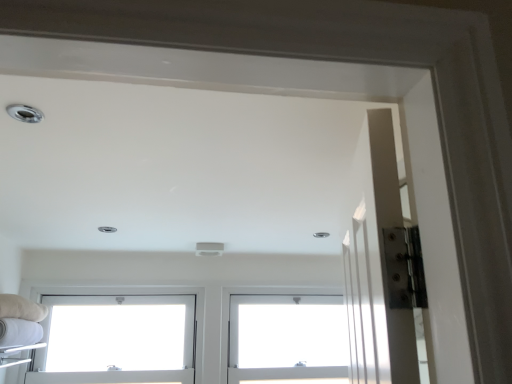
Question: Is white plastic window at lower left, the 1th window from the left, oriented away from white plastic window at center, the first window viewed from the right?

Choices:
 (A) yes
 (B) no

Answer: (B)

Question: Is white plastic window at lower left, the 1th window from the left, taller than white plastic window at center, the first window viewed from the right?

Choices:
 (A) no
 (B) yes

Answer: (A)

Question: Is white plastic window at lower left, the 1th window from the left, in front of white plastic window at center, which appears as the second window when viewed from the left?

Choices:
 (A) no
 (B) yes

Answer: (B)

Question: Is white plastic window at lower left, which appears as the second window when viewed from the right, bigger than white plastic window at center, the first window viewed from the right?

Choices:
 (A) no
 (B) yes

Answer: (B)

Question: Is white plastic window at lower left, the 1th window from the left, outside of white plastic window at center, which appears as the second window when viewed from the left?

Choices:
 (A) no
 (B) yes

Answer: (B)

Question: Does white plastic window at lower left, the 1th window from the left, turn towards white plastic window at center, the first window viewed from the right?

Choices:
 (A) yes
 (B) no

Answer: (B)

Question: Is white plastic window at center, the first window viewed from the right, taller than white plastic window at lower left, which appears as the second window when viewed from the right?

Choices:
 (A) yes
 (B) no

Answer: (A)

Question: Are white plastic window at center, which appears as the second window when viewed from the left, and white plastic window at lower left, the 1th window from the left, beside each other?

Choices:
 (A) no
 (B) yes

Answer: (A)

Question: Is white plastic window at center, the first window viewed from the right, positioned beyond the bounds of white plastic window at lower left, the 1th window from the left?

Choices:
 (A) no
 (B) yes

Answer: (B)

Question: From a real-world perspective, is white plastic window at center, the first window viewed from the right, below white plastic window at lower left, which appears as the second window when viewed from the right?

Choices:
 (A) no
 (B) yes

Answer: (B)

Question: Is white plastic window at center, which appears as the second window when viewed from the left, further to camera compared to white plastic window at lower left, which appears as the second window when viewed from the right?

Choices:
 (A) no
 (B) yes

Answer: (B)

Question: Could you tell me if white plastic window at center, which appears as the second window when viewed from the left, is turned towards white plastic window at lower left, the 1th window from the left?

Choices:
 (A) no
 (B) yes

Answer: (A)

Question: Considering the positions of point (230, 380) and point (106, 309), is point (230, 380) closer or farther from the camera than point (106, 309)?

Choices:
 (A) closer
 (B) farther

Answer: (A)